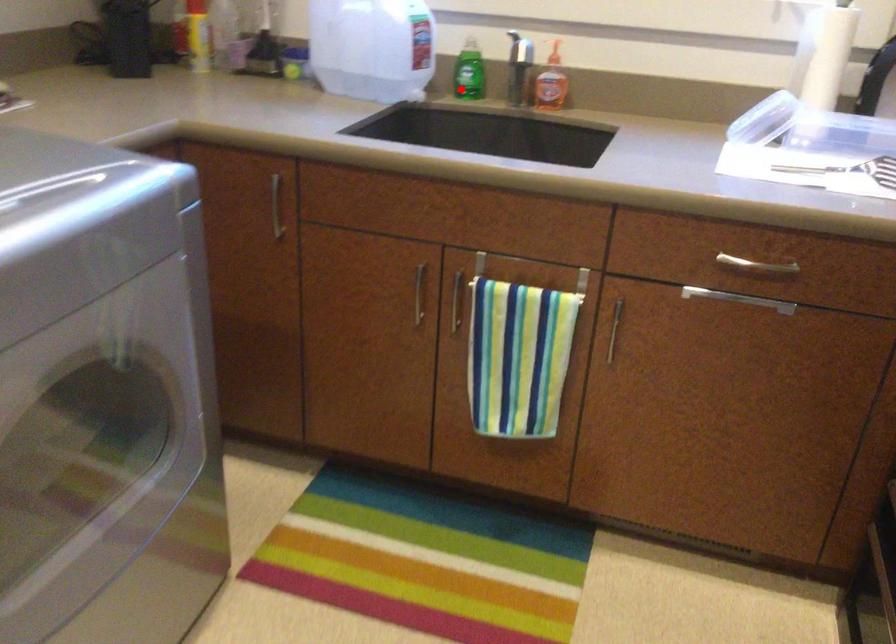
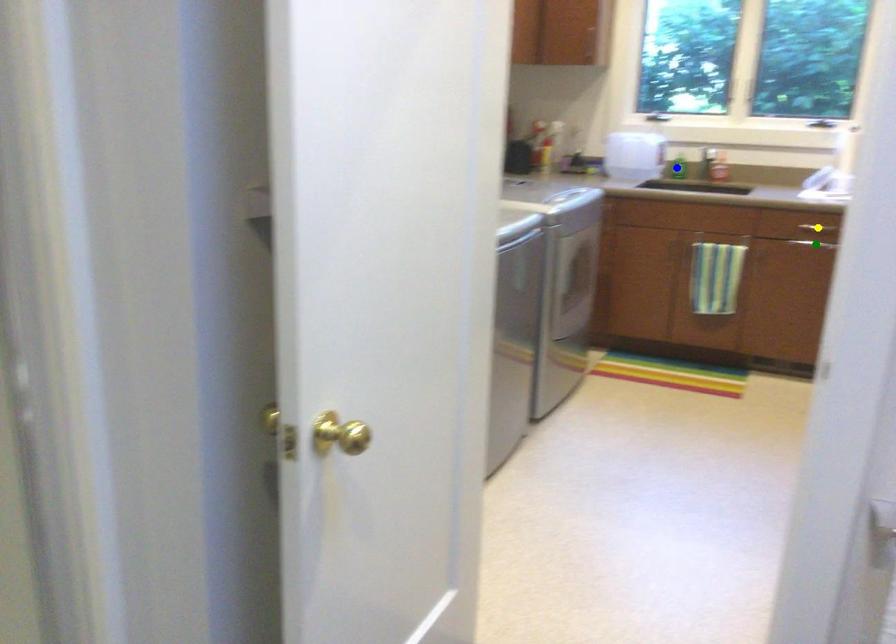
Question: I am providing you with two images of the same scene from different viewpoints. A red point is marked on the first image. You are given multiple points on the second image. Which spot in image 2 lines up with the point in image 1?

Choices:
 (A) blue point
 (B) green point
 (C) yellow point

Answer: (A)